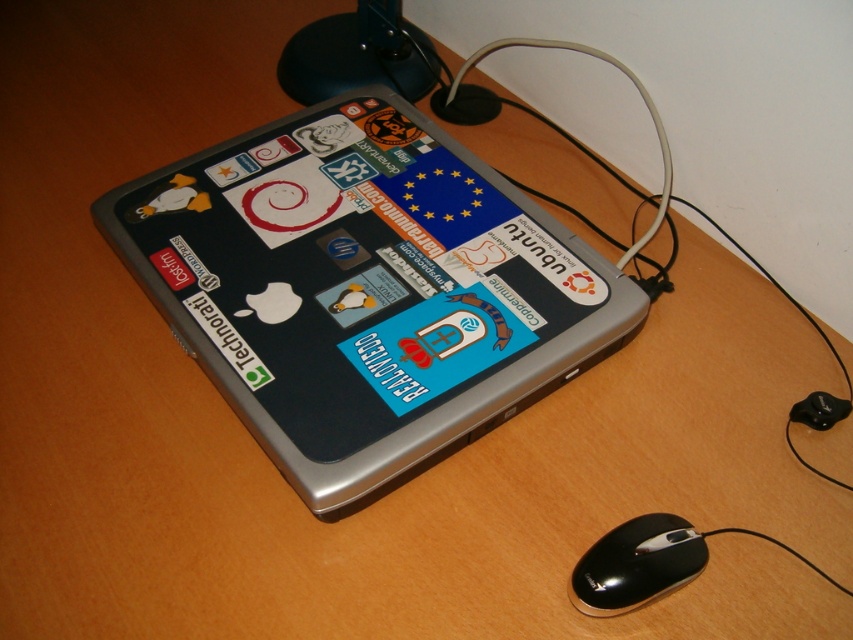
Measure the distance between point [465,323] and camera.

They are 1.15 meters apart.

Is point (338, 138) less distant than point (648, 557)?

That is False.

Find the location of a particular element. Image resolution: width=853 pixels, height=640 pixels. silver metallic laptop at center is located at coordinates (361, 288).